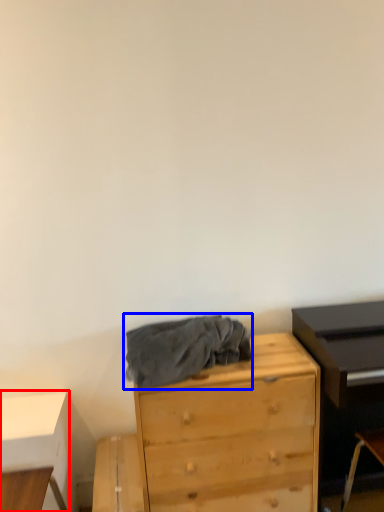
Question: Which of the following is the closest to the observer, table (highlighted by a red box) or clothing (highlighted by a blue box)?

Choices:
 (A) table
 (B) clothing

Answer: (B)